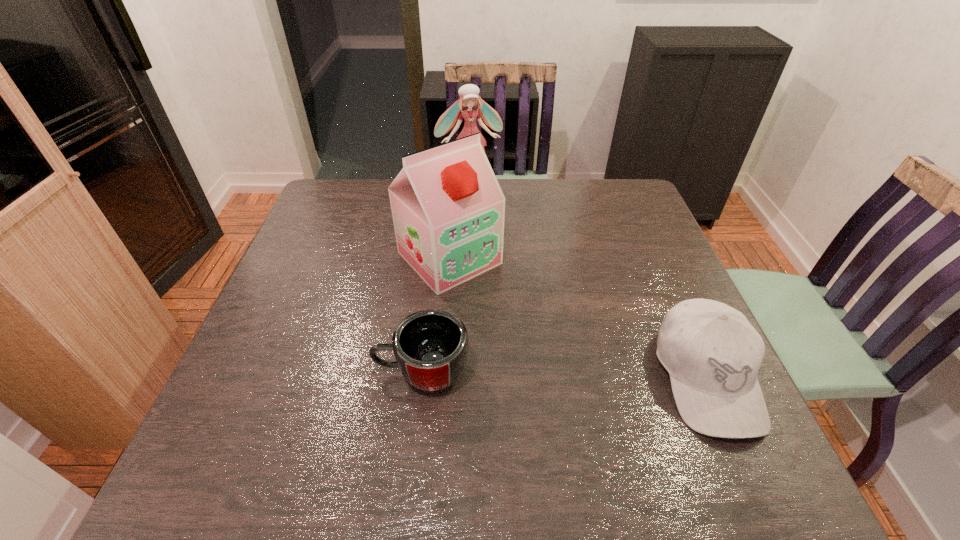
Find the location of a particular element. The height and width of the screenshot is (540, 960). free space located 0.330m with the cap open on the third nearest object is located at coordinates (574, 379).

I want to click on blank area located on the front-facing side of the doll, so click(487, 225).

The image size is (960, 540). I want to click on vacant space located 0.170m on the front-facing side of the doll, so click(487, 227).

Find the location of `vacant area situated on the front-facing side of the doll`. vacant area situated on the front-facing side of the doll is located at coordinates (504, 275).

I want to click on object that is at the far edge, so click(469, 98).

This screenshot has height=540, width=960. In order to click on mug that is positioned at the near edge in this screenshot , I will do `click(430, 346)`.

The width and height of the screenshot is (960, 540). Identify the location of baseball cap present at the near edge. (712, 353).

Identify the location of object that is at the right edge. The height and width of the screenshot is (540, 960). [x=712, y=353].

Where is `object located at the near right corner`? object located at the near right corner is located at coordinates pos(712,353).

The height and width of the screenshot is (540, 960). In the image, there is a desktop. What are the coordinates of `free space at the near edge` in the screenshot? It's located at [x=516, y=408].